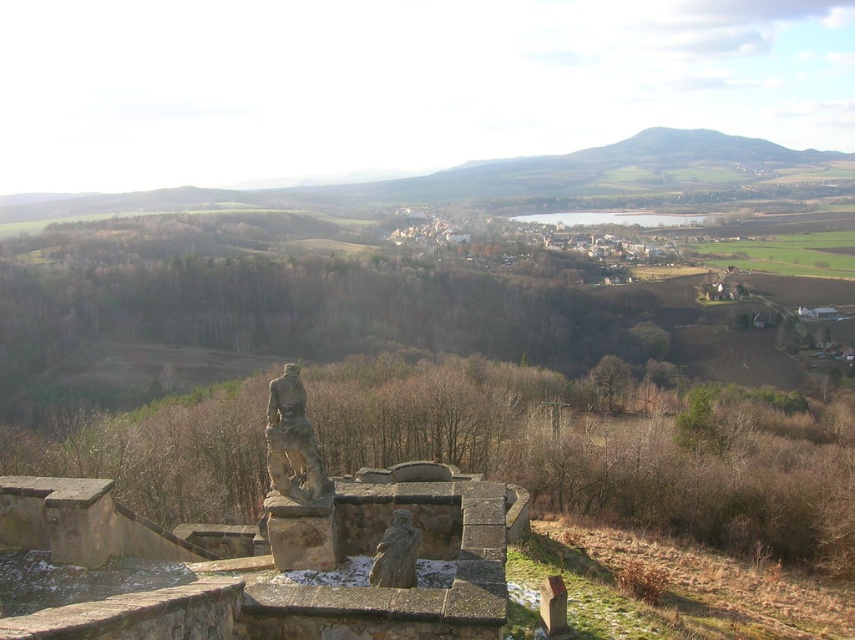
You are standing at the point marked as point (292,442) in the image. What object is located at this specific coordinate?

The stone statue at center is located at point (292,442).